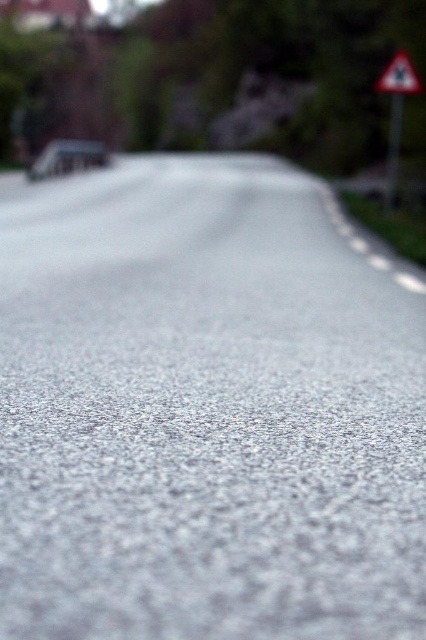
Is white triangular sign at upper right shorter than white reflective triangle at upper right?

No, white triangular sign at upper right is not shorter than white reflective triangle at upper right.

Is point (388, 150) in front of point (414, 72)?

No, (388, 150) is further to viewer.

Between point (400, 67) and point (405, 83), which one is positioned behind?

The point (405, 83) is more distant.

The image size is (426, 640). What are the coordinates of `white triangular sign at upper right` in the screenshot? It's located at (396, 112).